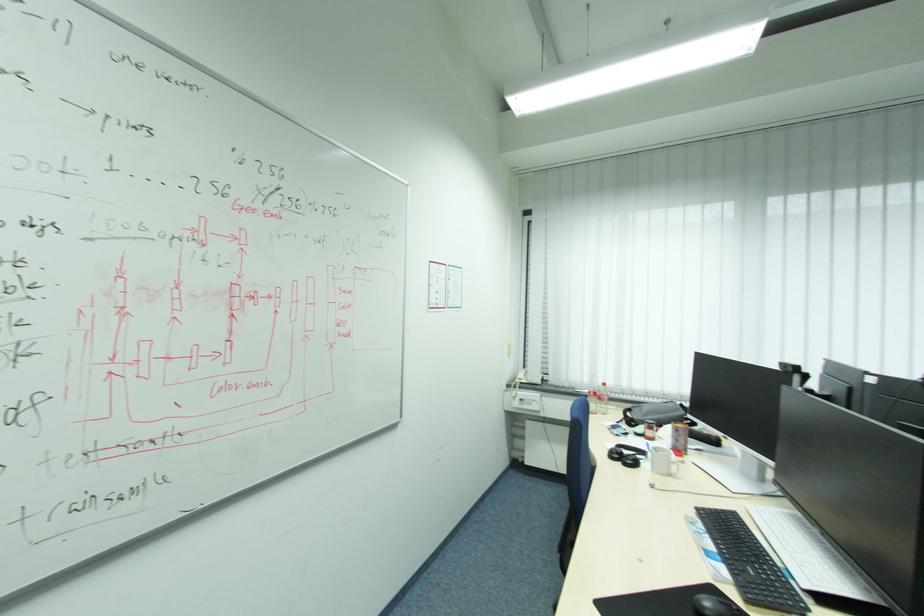
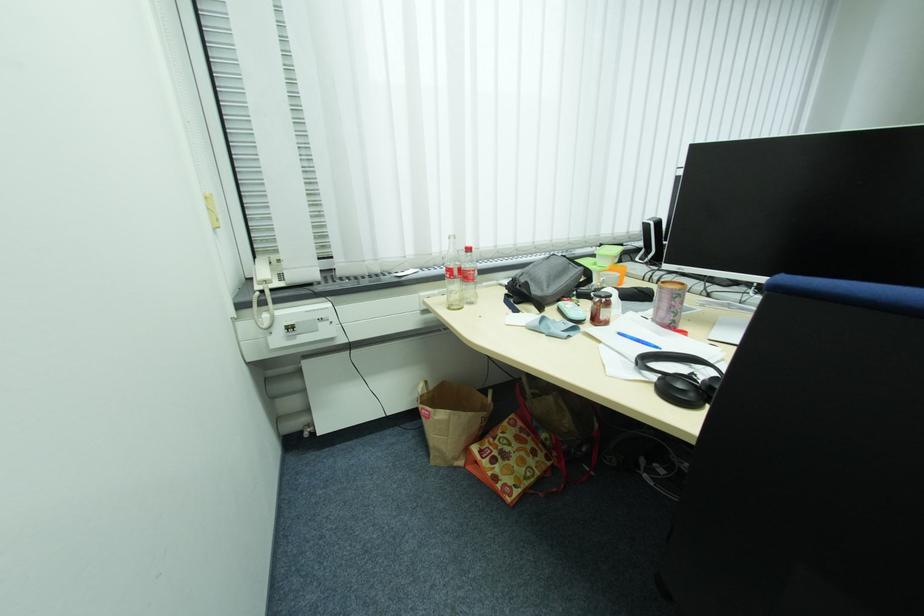
The point at (650, 416) is marked in the first image. Where is the corresponding point in the second image?

(554, 286)